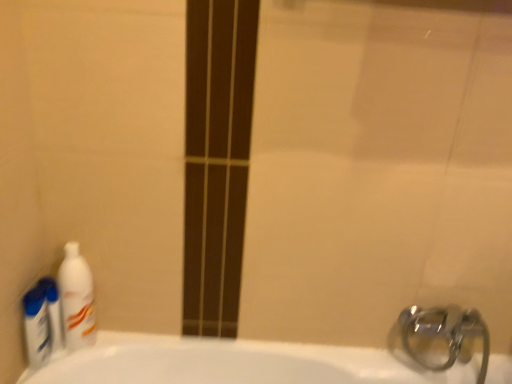
You are a GUI agent. You are given a task and a screenshot of the screen. Output one action in this format:
    pyautogui.click(x=<x>, y=<y>)
    Task: Click on the white glossy bottle at left, which is the 2th cleaning product from left to right
    
    Given the screenshot: What is the action you would take?
    pyautogui.click(x=76, y=299)

What is the approximate width of blue plastic bottles at left, arranged as the 1th cleaning product when viewed from the left?

blue plastic bottles at left, arranged as the 1th cleaning product when viewed from the left, is 7.67 centimeters wide.

This screenshot has width=512, height=384. I want to click on white glossy mouthwash at left, so click(53, 310).

Which object is closer to the camera, white glossy bottle at left, which is the 1th cleaning product in right-to-left order, or white glossy mouthwash at left?

white glossy bottle at left, which is the 1th cleaning product in right-to-left order, is in front.

From a real-world perspective, who is located lower, white glossy bottle at left, which is the 1th cleaning product in right-to-left order, or white glossy mouthwash at left?

white glossy mouthwash at left, from a real-world perspective.

From the picture: Based on their sizes in the image, would you say white glossy bottle at left, which is the 1th cleaning product in right-to-left order, is bigger or smaller than white glossy mouthwash at left?

In the image, white glossy bottle at left, which is the 1th cleaning product in right-to-left order, appears to be larger than white glossy mouthwash at left.

From the image's perspective, would you say blue plastic bottles at left, arranged as the 1th cleaning product when viewed from the left, is shown under white glossy mouthwash at left?

Yes.

Considering the points (46, 296) and (56, 302), which point is behind, point (46, 296) or point (56, 302)?

Point (56, 302)

Is blue plastic bottles at left, arranged as the 1th cleaning product when viewed from the left, in contact with white glossy mouthwash at left?

Yes, the surface of blue plastic bottles at left, arranged as the 1th cleaning product when viewed from the left, is in contact with white glossy mouthwash at left.

From a real-world perspective, does white glossy bottle at left, which is the 2th cleaning product from left to right, sit lower than blue plastic bottles at left, arranged as the 1th cleaning product when viewed from the left?

No, from a real-world perspective, white glossy bottle at left, which is the 2th cleaning product from left to right, is not under blue plastic bottles at left, arranged as the 1th cleaning product when viewed from the left.

Looking at this image, is white glossy bottle at left, which is the 1th cleaning product in right-to-left order, looking in the opposite direction of blue plastic bottles at left, which is the 2th cleaning product from right to left?

No.

Looking at this image, is white glossy bottle at left, which is the 1th cleaning product in right-to-left order, inside or outside of blue plastic bottles at left, arranged as the 1th cleaning product when viewed from the left?

white glossy bottle at left, which is the 1th cleaning product in right-to-left order, cannot be found inside blue plastic bottles at left, arranged as the 1th cleaning product when viewed from the left.

Is white glossy bottle at left, which is the 1th cleaning product in right-to-left order, positioned in front of blue plastic bottles at left, which is the 2th cleaning product from right to left?

No, it is not.

Can you confirm if white glossy mouthwash at left is positioned to the right of white glossy bottle at left, which is the 2th cleaning product from left to right?

In fact, white glossy mouthwash at left is to the left of white glossy bottle at left, which is the 2th cleaning product from left to right.

Looking at this image, would you say white glossy mouthwash at left is inside or outside white glossy bottle at left, which is the 1th cleaning product in right-to-left order?

white glossy mouthwash at left is not enclosed by white glossy bottle at left, which is the 1th cleaning product in right-to-left order.

Could you tell me if white glossy mouthwash at left is facing white glossy bottle at left, which is the 2th cleaning product from left to right?

No, white glossy mouthwash at left is not aimed at white glossy bottle at left, which is the 2th cleaning product from left to right.

Between white glossy mouthwash at left and white glossy bottle at left, which is the 2th cleaning product from left to right, which one is positioned behind?

white glossy mouthwash at left is further from the camera.

From a real-world perspective, is blue plastic bottles at left, which is the 2th cleaning product from right to left, above or below white glossy bottle at left, which is the 1th cleaning product in right-to-left order?

From a real-world perspective, blue plastic bottles at left, which is the 2th cleaning product from right to left, is physically below white glossy bottle at left, which is the 1th cleaning product in right-to-left order.

Considering the sizes of blue plastic bottles at left, arranged as the 1th cleaning product when viewed from the left, and white glossy bottle at left, which is the 1th cleaning product in right-to-left order, in the image, is blue plastic bottles at left, arranged as the 1th cleaning product when viewed from the left, bigger or smaller than white glossy bottle at left, which is the 1th cleaning product in right-to-left order,?

blue plastic bottles at left, arranged as the 1th cleaning product when viewed from the left, is smaller than white glossy bottle at left, which is the 1th cleaning product in right-to-left order.

In the scene shown: From the image's perspective, which one is positioned lower, blue plastic bottles at left, which is the 2th cleaning product from right to left, or white glossy bottle at left, which is the 2th cleaning product from left to right?

blue plastic bottles at left, which is the 2th cleaning product from right to left, appears lower in the image.

Looking at this image, what's the angular difference between blue plastic bottles at left, which is the 2th cleaning product from right to left, and white glossy bottle at left, which is the 1th cleaning product in right-to-left order,'s facing directions?

The angle between the facing direction of blue plastic bottles at left, which is the 2th cleaning product from right to left, and the facing direction of white glossy bottle at left, which is the 1th cleaning product in right-to-left order, is 90 degrees.

Do you think white glossy mouthwash at left is within blue plastic bottles at left, which is the 2th cleaning product from right to left, or outside of it?

The correct answer is: outside.

From the image's perspective, which is above, white glossy mouthwash at left or blue plastic bottles at left, which is the 2th cleaning product from right to left?

white glossy mouthwash at left is shown above in the image.

In the scene shown: Would you consider white glossy mouthwash at left to be distant from blue plastic bottles at left, which is the 2th cleaning product from right to left?

No, white glossy mouthwash at left is in close proximity to blue plastic bottles at left, which is the 2th cleaning product from right to left.

From a real-world perspective, is white glossy mouthwash at left on blue plastic bottles at left, which is the 2th cleaning product from right to left?

Yes, from a real-world perspective, white glossy mouthwash at left is on top of blue plastic bottles at left, which is the 2th cleaning product from right to left.

The width and height of the screenshot is (512, 384). Identify the location of cleaning product above the white glossy mouthwash at left (from a real-world perspective). (76, 299).

I want to click on cleaning product below the white glossy mouthwash at left (from the image's perspective), so click(x=42, y=321).

When comparing their distances from white glossy bottle at left, which is the 1th cleaning product in right-to-left order, does white glossy mouthwash at left or blue plastic bottles at left, arranged as the 1th cleaning product when viewed from the left, seem further?

Based on the image, blue plastic bottles at left, arranged as the 1th cleaning product when viewed from the left, appears to be further to white glossy bottle at left, which is the 1th cleaning product in right-to-left order.

Estimate the real-world distances between objects in this image. Which object is closer to blue plastic bottles at left, arranged as the 1th cleaning product when viewed from the left, white glossy bottle at left, which is the 1th cleaning product in right-to-left order, or white glossy mouthwash at left?

white glossy mouthwash at left lies closer to blue plastic bottles at left, arranged as the 1th cleaning product when viewed from the left, than the other object.

When comparing their distances from blue plastic bottles at left, which is the 2th cleaning product from right to left, does white glossy mouthwash at left or white glossy bottle at left, which is the 2th cleaning product from left to right, seem further?

Among the two, white glossy bottle at left, which is the 2th cleaning product from left to right, is located further to blue plastic bottles at left, which is the 2th cleaning product from right to left.

Consider the image. Considering their positions, is blue plastic bottles at left, which is the 2th cleaning product from right to left, positioned further to white glossy mouthwash at left than white glossy bottle at left, which is the 1th cleaning product in right-to-left order?

The object further to white glossy mouthwash at left is white glossy bottle at left, which is the 1th cleaning product in right-to-left order.

In the scene shown: Estimate the real-world distances between objects in this image. Which object is closer to white glossy bottle at left, which is the 1th cleaning product in right-to-left order, blue plastic bottles at left, arranged as the 1th cleaning product when viewed from the left, or white glossy mouthwash at left?

white glossy mouthwash at left lies closer to white glossy bottle at left, which is the 1th cleaning product in right-to-left order, than the other object.

Estimate the real-world distances between objects in this image. Which object is further from white glossy mouthwash at left, white glossy bottle at left, which is the 1th cleaning product in right-to-left order, or blue plastic bottles at left, which is the 2th cleaning product from right to left?

Based on the image, white glossy bottle at left, which is the 1th cleaning product in right-to-left order, appears to be further to white glossy mouthwash at left.

What are the coordinates of `mouthwash between blue plastic bottles at left, arranged as the 1th cleaning product when viewed from the left, and white glossy bottle at left, which is the 2th cleaning product from left to right, in the horizontal direction` in the screenshot? It's located at (53, 310).